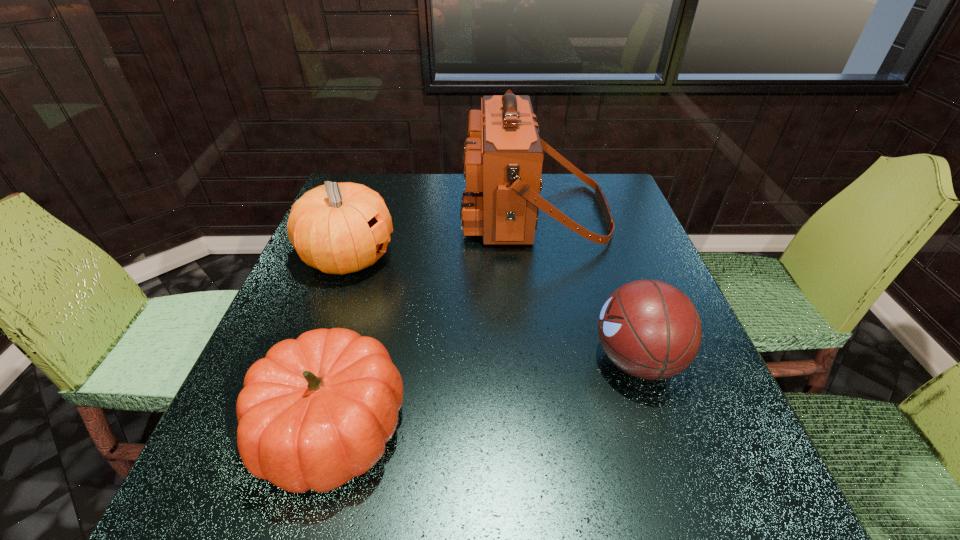
I want to click on satchel, so click(x=502, y=159).

In order to click on the farther pumpkin in this screenshot , I will do `click(338, 228)`.

You are a GUI agent. You are given a task and a screenshot of the screen. Output one action in this format:
    pyautogui.click(x=<x>, y=<y>)
    Task: Click on the taller pumpkin
    The width and height of the screenshot is (960, 540).
    Given the screenshot: What is the action you would take?
    pyautogui.click(x=338, y=228)

This screenshot has height=540, width=960. In order to click on basketball in this screenshot , I will do `click(649, 329)`.

You are a GUI agent. You are given a task and a screenshot of the screen. Output one action in this format:
    pyautogui.click(x=<x>, y=<y>)
    Task: Click on the nearer pumpkin
    This screenshot has height=540, width=960.
    Given the screenshot: What is the action you would take?
    pyautogui.click(x=317, y=411)

You are a GUI agent. You are given a task and a screenshot of the screen. Output one action in this format:
    pyautogui.click(x=<x>, y=<y>)
    Task: Click on the vacant area located on the face side of the satchel
    Image resolution: width=960 pixels, height=540 pixels.
    Given the screenshot: What is the action you would take?
    pyautogui.click(x=392, y=213)

Image resolution: width=960 pixels, height=540 pixels. I want to click on vacant region located 0.260m on the face side of the satchel, so click(x=371, y=213).

I want to click on free point located 0.360m on the face side of the satchel, so click(335, 213).

Locate an element on the screen. vacant area situated on the front-facing side of the taller pumpkin is located at coordinates (516, 258).

You are a GUI agent. You are given a task and a screenshot of the screen. Output one action in this format:
    pyautogui.click(x=<x>, y=<y>)
    Task: Click on the vacant region located on the left of the basketball
    
    Given the screenshot: What is the action you would take?
    pyautogui.click(x=530, y=360)